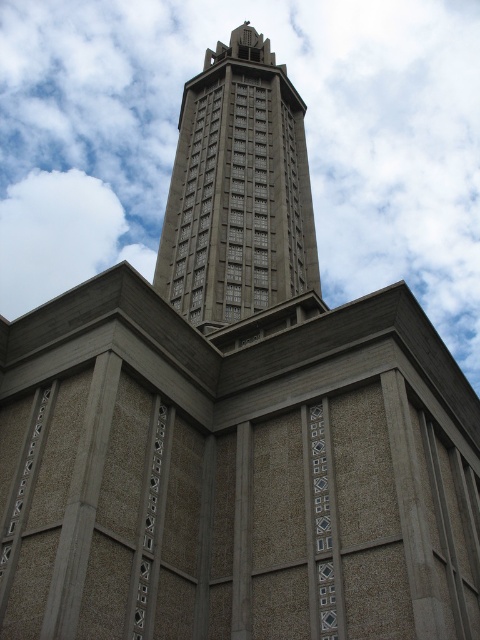
You are standing in front of the architectural structure and want to determine the relative positions of two points on its facade. The first point is at coordinates point (317, 168), and the second is at point (276, 86). Which point is closer to you?

Point (317, 168) is further to the viewer than point (276, 86), so the point closer to you is point (276, 86).

You are an architect analyzing the image. You need to determine which object occupies a larger horizontal space in the scene between the white fluffy cloud at upper center and the gray stone tower at center. Which one is wider?

The white fluffy cloud at upper center is wider than the gray stone tower at center according to the description.

You are standing at a point 233.14 meters away from the point marked at coordinates point (128, 196). Given that the tower in the scene is 100 meters tall, can you estimate the angle of elevation from your position to the top of the tower?

Using trigonometry, the angle of elevation can be calculated using the tangent function. The height of the tower is 100 meters, and the horizontal distance is 233.14 meters. The angle is arctangent of 100 divided by 233.14, which is approximately 23 degrees.